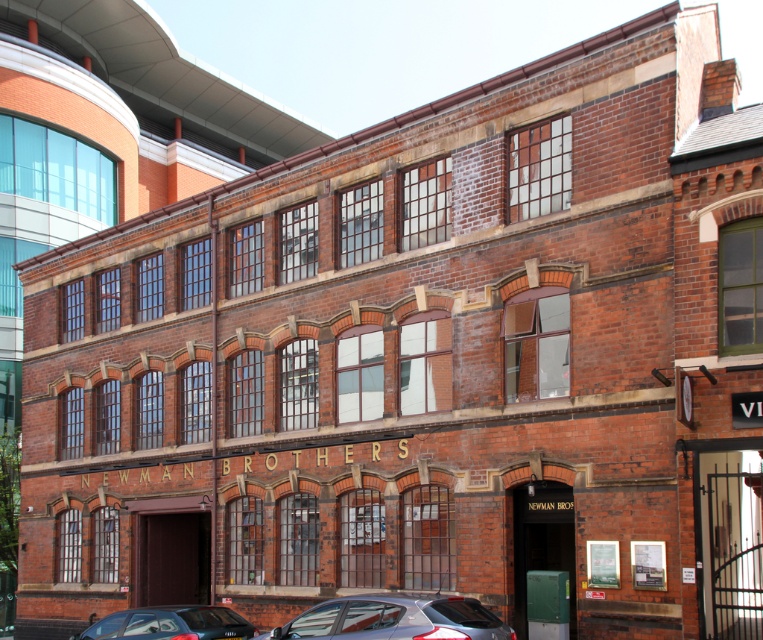
Which of these two, satin silver car at lower center or shiny black car at lower left, stands taller?

Standing taller between the two is shiny black car at lower left.

Between point (472, 634) and point (161, 627), which one is positioned behind?

Point (161, 627)

The width and height of the screenshot is (763, 640). Describe the element at coordinates (394, 620) in the screenshot. I see `satin silver car at lower center` at that location.

Identify the location of satin silver car at lower center. (394, 620).